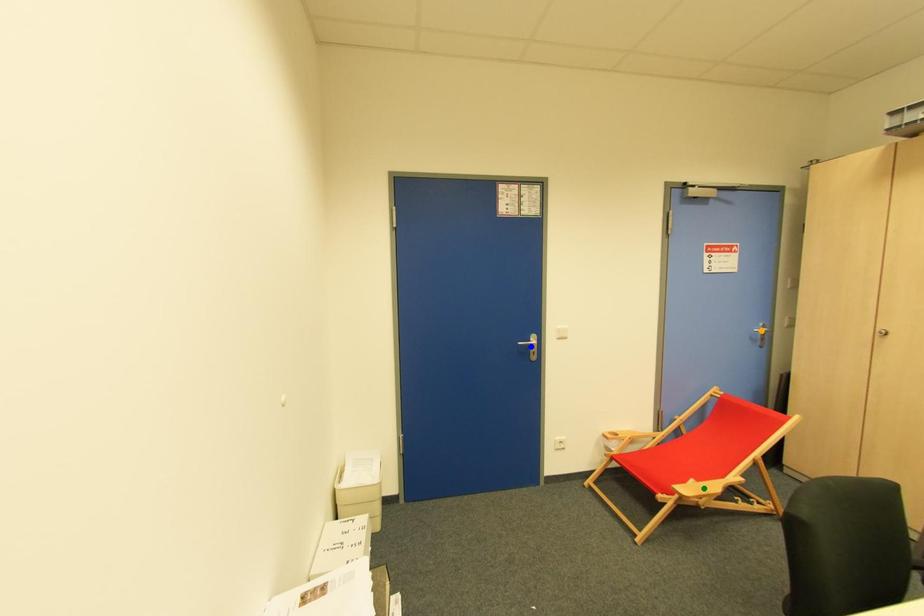
Order these from nearest to farthest:
- blue point
- green point
- orange point

1. green point
2. blue point
3. orange point